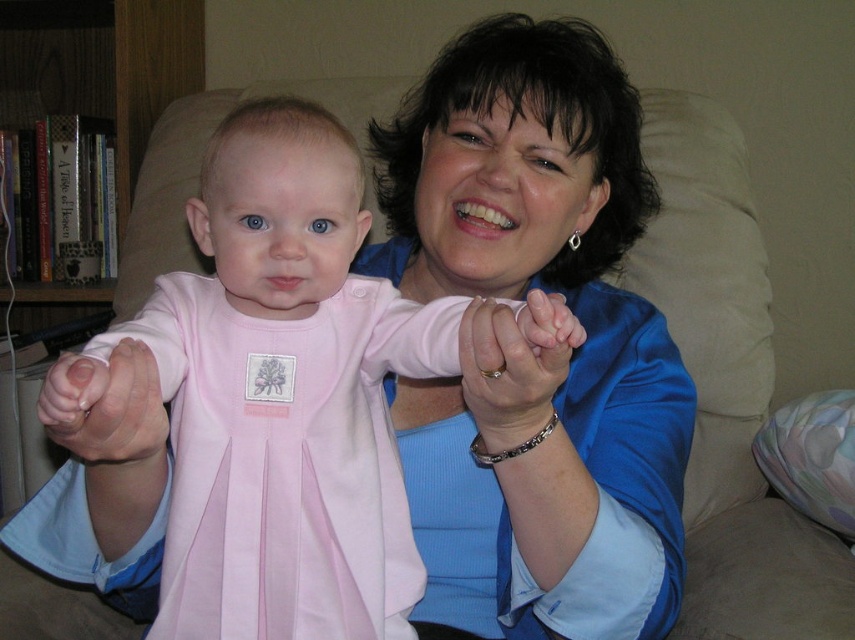
Can you confirm if pink satin dress at center is positioned to the right of smooth skin hand at center?

Incorrect, pink satin dress at center is not on the right side of smooth skin hand at center.

Does pink satin dress at center have a larger size compared to smooth skin hand at center?

Indeed, pink satin dress at center has a larger size compared to smooth skin hand at center.

Identify the location of pink satin dress at center. This screenshot has width=855, height=640. (279, 209).

Locate an element on the screen. pink satin dress at center is located at coordinates click(x=279, y=209).

Is the position of pink satin dress at center less distant than that of pink fabric baby hand at center?

No, it is behind pink fabric baby hand at center.

Which is below, pink satin dress at center or pink fabric baby hand at center?

pink fabric baby hand at center is lower down.

Does point (249, 292) lie behind point (96, 424)?

Yes, point (249, 292) is farther from viewer.

Where is `pink satin dress at center`? pink satin dress at center is located at coordinates (279, 209).

Is point (486, 385) behind point (81, 419)?

Yes.

Which is in front, point (506, 408) or point (119, 436)?

Point (119, 436) is in front.

What are the coordinates of `smooth skin hand at center` in the screenshot? It's located at (516, 360).